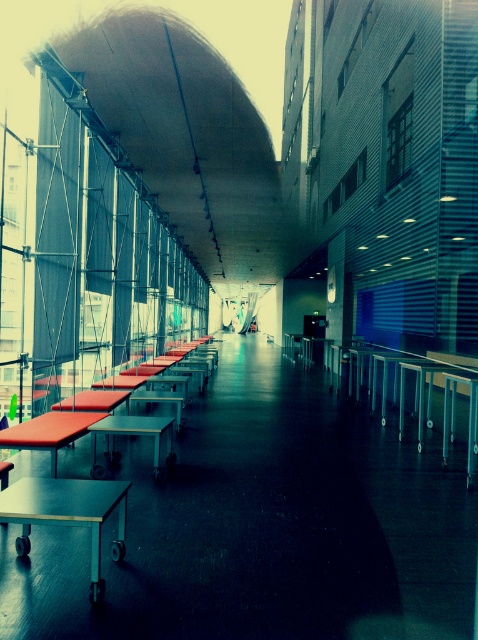
Question: Which object is positioned closest to the matte metal table at left?

Choices:
 (A) wooden picnic table at center
 (B) white glossy table at center
 (C) light brown wooden table at center
 (D) light brown wooden table at lower left

Answer: (B)

Question: From the image, what is the correct spatial relationship of light brown wooden table at lower left in relation to white glossy table at center?

Choices:
 (A) left
 (B) right

Answer: (A)

Question: Which object is the closest to the light brown wooden table at center?

Choices:
 (A) matte metal table at left
 (B) white glossy table at center
 (C) light brown wooden table at lower left
 (D) wooden picnic table at center

Answer: (B)

Question: Does light brown wooden table at lower left lie in front of white glossy table at center?

Choices:
 (A) yes
 (B) no

Answer: (A)

Question: Does wooden picnic table at center lie behind light brown wooden table at lower left?

Choices:
 (A) no
 (B) yes

Answer: (B)

Question: Which object is farther from the camera taking this photo?

Choices:
 (A) light brown wooden table at lower left
 (B) light brown wooden table at center
 (C) white glossy table at center

Answer: (B)